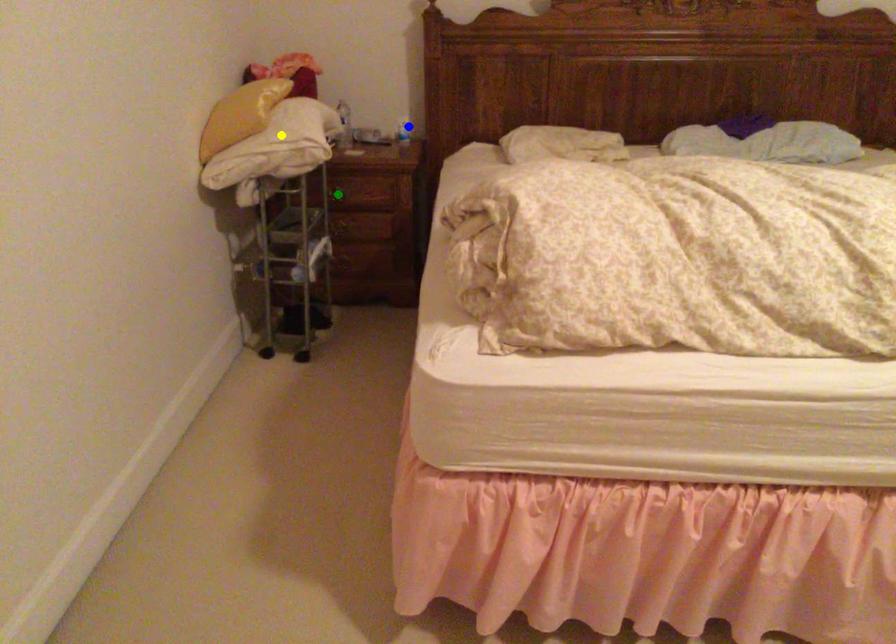
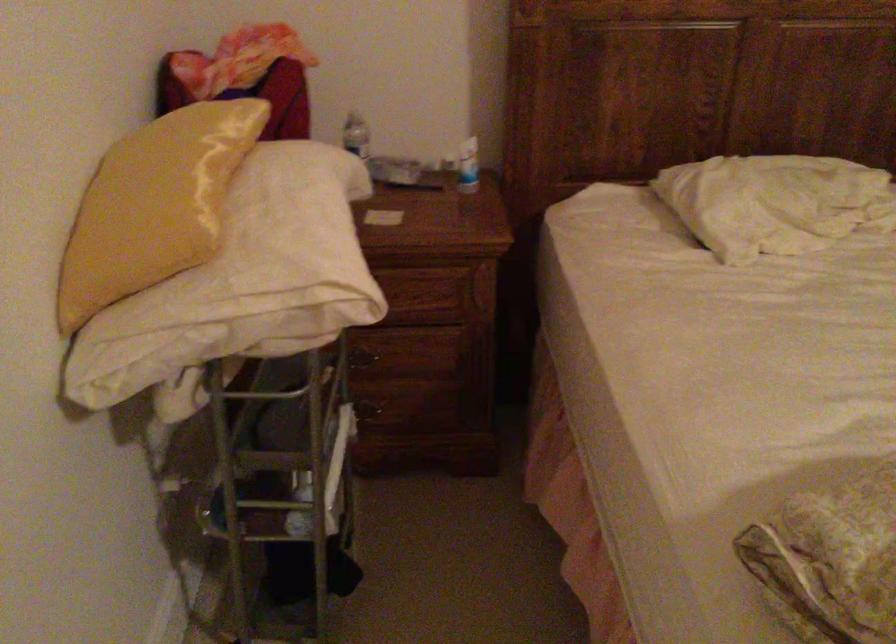
I am providing you with two images of the same scene from different viewpoints. Three points are marked in image1. Which point corresponds to a part or object that is occluded in image2?In image1, three points are marked. Which of them correspond to a part or object that is occluded in image2?Among the three points shown in image1, which one corresponds to a part or object that is no longer visible due to occlusion in image2?

green point cannot be seen in image2.